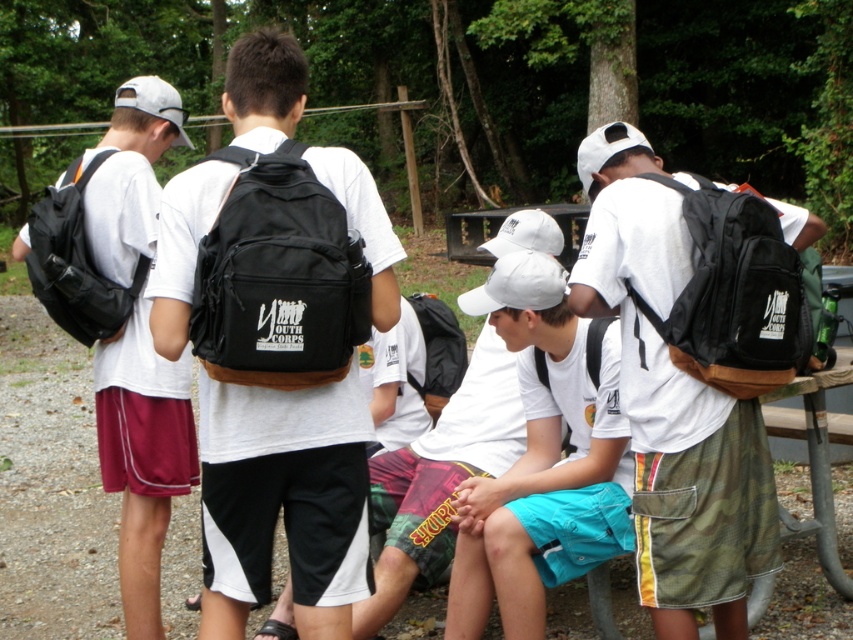
You need to choose a backpack to carry your supplies for a short hike. Which backpack between the matte black backpack at left and the black fabric backpack at back has a smaller width?

The matte black backpack at left has a smaller width than the black fabric backpack at back.

You are a photographer standing at the center of the scene. You need to capture a photo that includes both the matte black backpack at left and the black fabric backpack at back. What is the minimum distance you need to move backward to ensure both backpacks are in frame?

The minimum distance you need to move backward is 19.59 inches to ensure both the matte black backpack at left and the black fabric backpack at back are in frame.